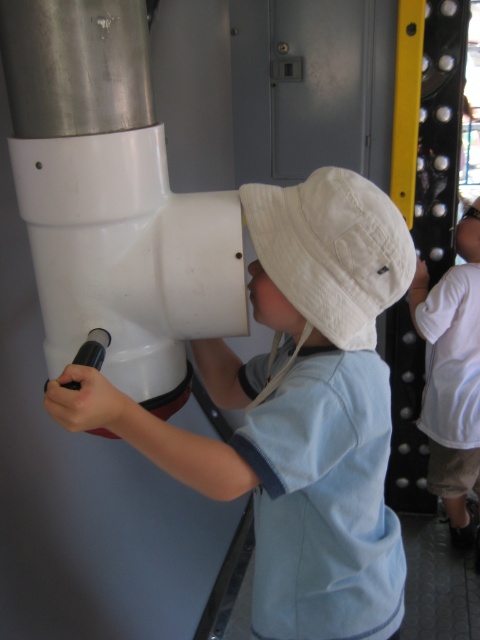
Can you confirm if white matte hat at center is positioned below white cotton hat at upper center?

Incorrect, white matte hat at center is not positioned below white cotton hat at upper center.

Is white matte hat at center positioned in front of white cotton hat at upper center?

Yes, white matte hat at center is closer to the viewer.

Locate an element on the screen. This screenshot has width=480, height=640. white matte hat at center is located at coordinates (297, 410).

Image resolution: width=480 pixels, height=640 pixels. Find the location of `white matte hat at center`. white matte hat at center is located at coordinates (297, 410).

Can you confirm if white matte telescope at center is positioned to the right of white cotton hat at upper center?

No, white matte telescope at center is not to the right of white cotton hat at upper center.

Based on the photo, can you confirm if white matte telescope at center is smaller than white cotton hat at upper center?

Yes, white matte telescope at center is smaller than white cotton hat at upper center.

Is point (168, 264) positioned behind point (477, 326)?

No, (168, 264) is closer to viewer.

Find the location of `white matte telescope at center`. white matte telescope at center is located at coordinates (112, 198).

Which of these two, white matte hat at center or white matte telescope at center, stands shorter?

With less height is white matte telescope at center.

Does white matte hat at center have a greater width compared to white matte telescope at center?

Yes.

Which is behind, point (331, 264) or point (36, 148)?

Point (36, 148)

Locate an element on the screen. This screenshot has width=480, height=640. white matte hat at center is located at coordinates (297, 410).